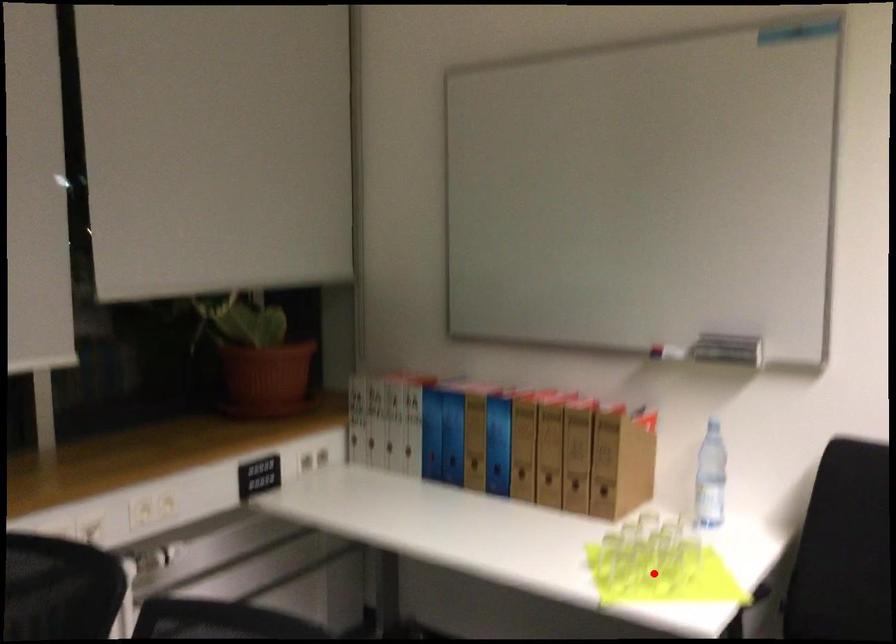
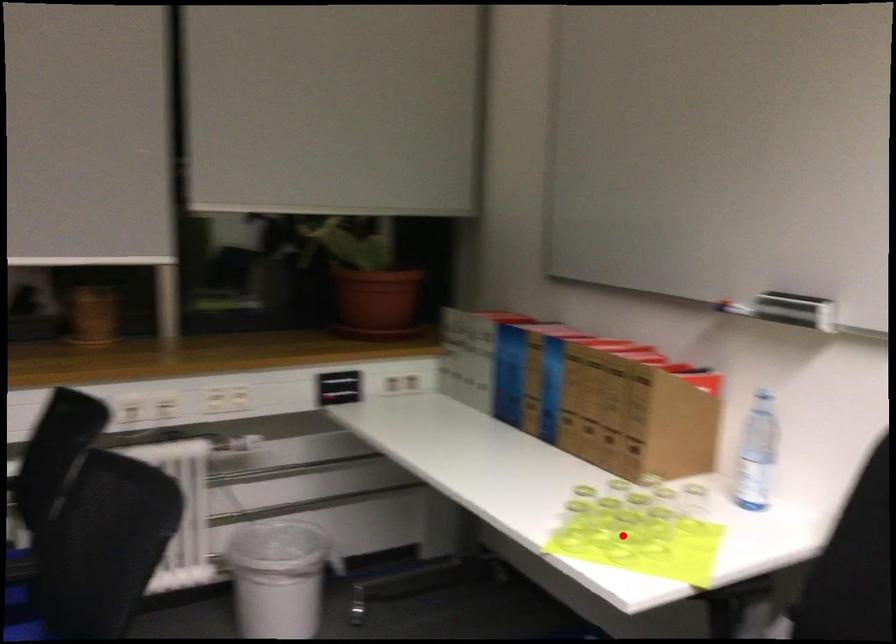
Consider the image. I am providing you with two images of the same scene from different viewpoints. A red point is marked on the first image and another point is marked on the second image. Is the marked point in image1 the same physical position as the marked point in image2?

Yes